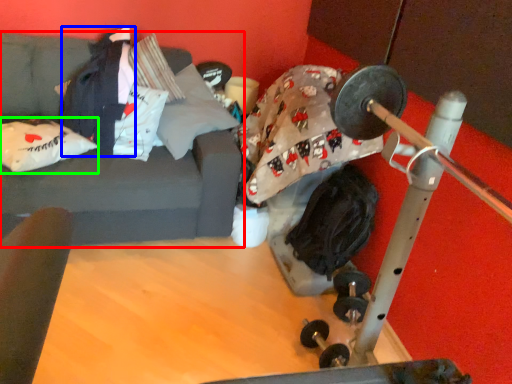
Question: Which object is the closest to the studio couch (highlighted by a red box)? Choose among these: clothing (highlighted by a blue box) or pillow (highlighted by a green box).

Choices:
 (A) clothing
 (B) pillow

Answer: (B)